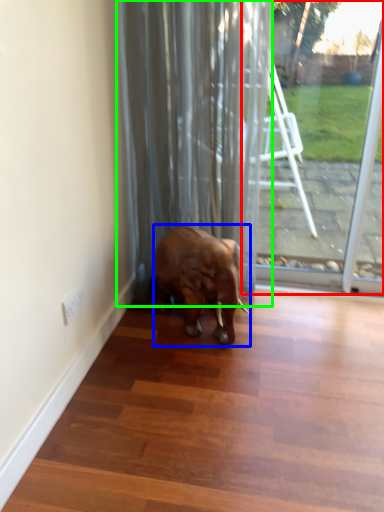
Question: Based on their relative distances, which object is farther from glass door (highlighted by a red box)? Choose from elephant (highlighted by a blue box) and curtain (highlighted by a green box).

Choices:
 (A) elephant
 (B) curtain

Answer: (A)